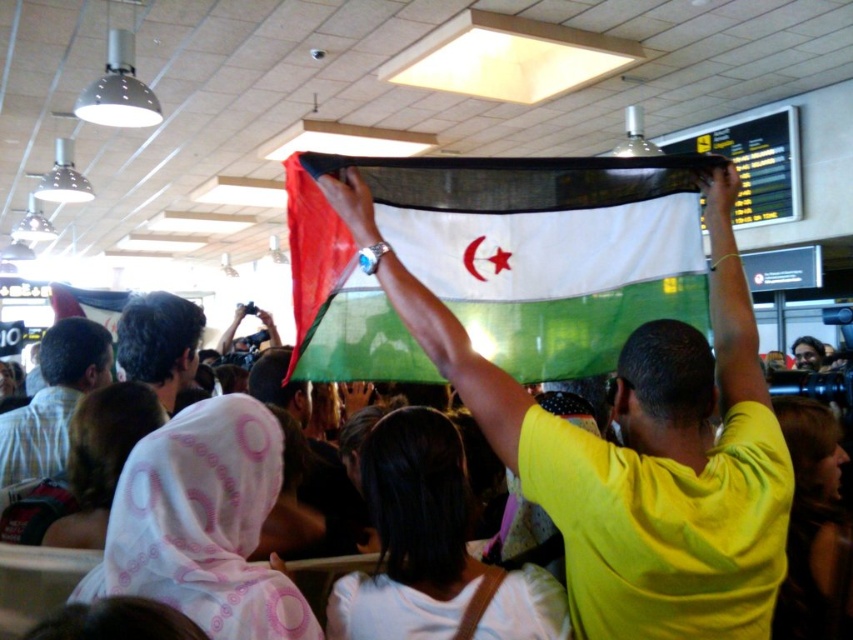
Between light brown shirt at center and dark brown hair at center, which one has less height?

dark brown hair at center

Does light brown shirt at center appear over dark brown hair at center?

Incorrect, light brown shirt at center is not positioned above dark brown hair at center.

Is point (67, 346) positioned in front of point (183, 378)?

No.

The height and width of the screenshot is (640, 853). I want to click on light brown shirt at center, so click(x=53, y=400).

Can you confirm if green fabric flag at center is bigger than light brown shirt at center?

Correct, green fabric flag at center is larger in size than light brown shirt at center.

Who is more forward, (549,291) or (73,371)?

Positioned in front is point (549,291).

Who is more forward, (409, 205) or (22, 432)?

Point (409, 205) is in front.

The image size is (853, 640). What are the coordinates of `green fabric flag at center` in the screenshot? It's located at (498, 260).

Is yellow matte shirt at upper center in front of dark brown hair at center?

Yes, it is.

Is point (677, 440) in front of point (192, 336)?

Yes.

Locate an element on the screen. The height and width of the screenshot is (640, 853). yellow matte shirt at upper center is located at coordinates (634, 451).